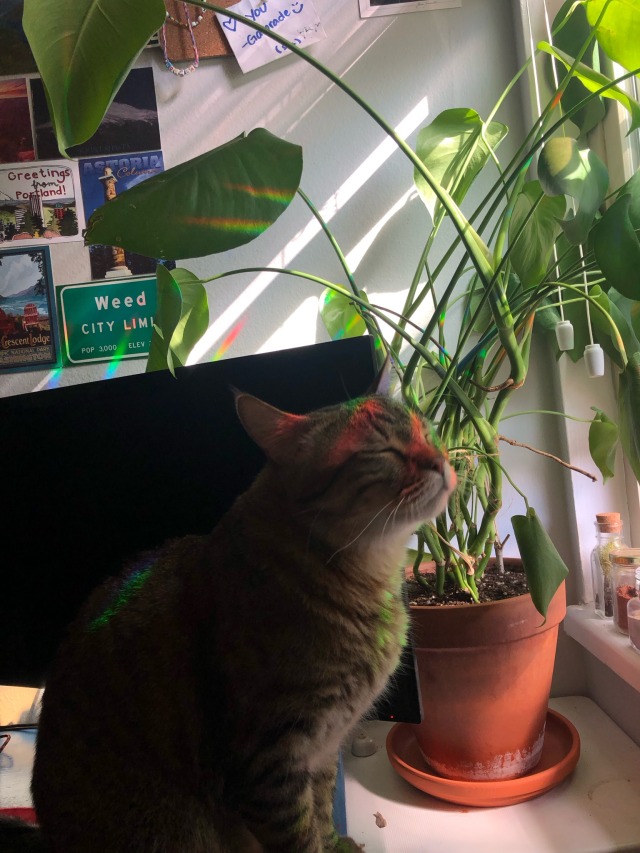
The height and width of the screenshot is (853, 640). I want to click on pot saucer, so tap(480, 798).